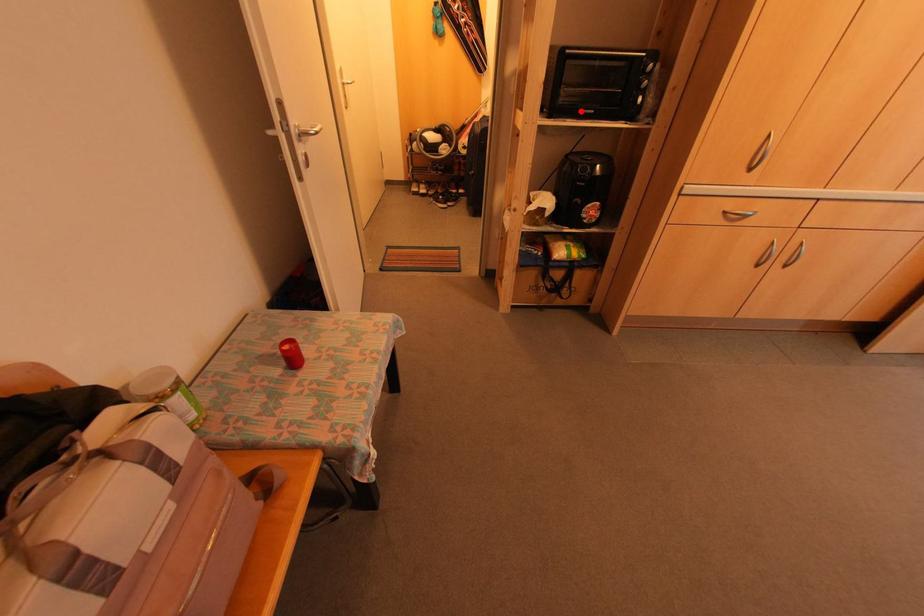
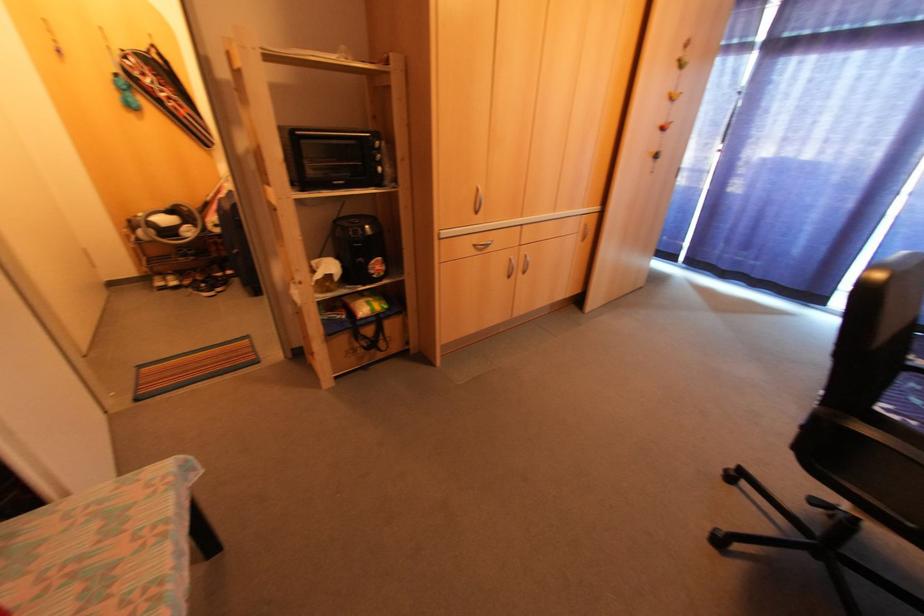
In the second image, find the point that corresponds to the highlighted location in the first image.

(334, 184)